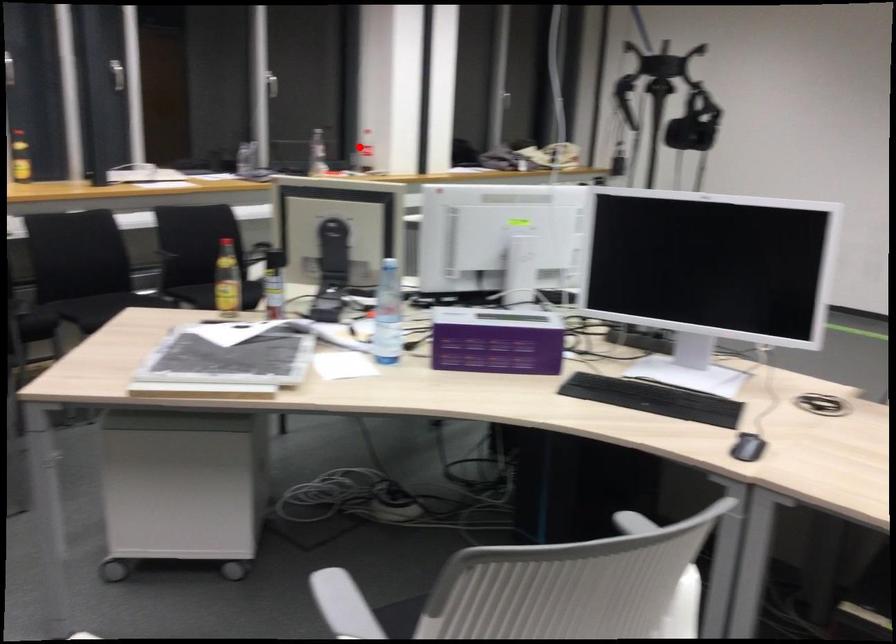
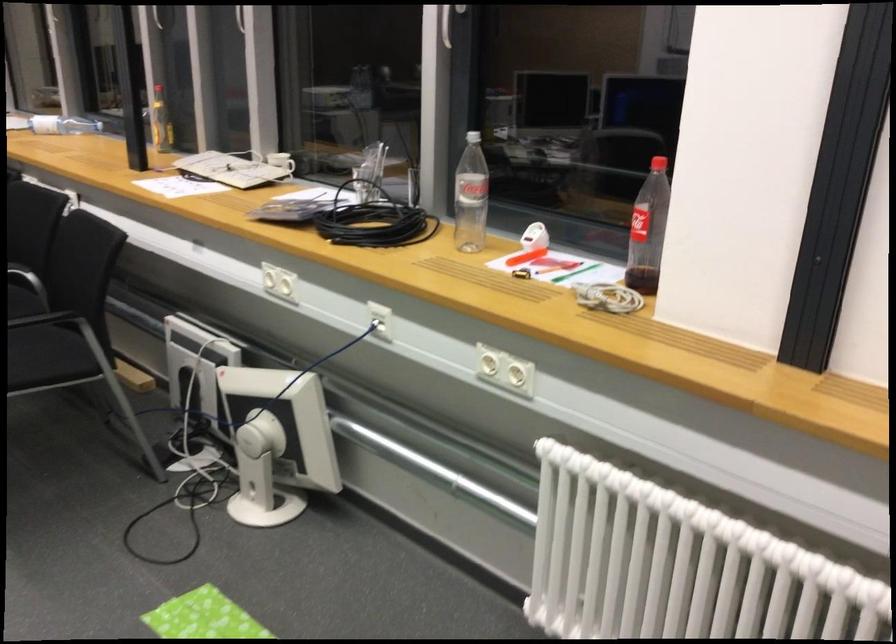
Question: I am providing you with two images of the same scene from different viewpoints. Given a red point in image1, look at the same physical point in image2. Is it:

Choices:
 (A) Closer to the viewpoint
 (B) Farther from the viewpoint

Answer: (A)